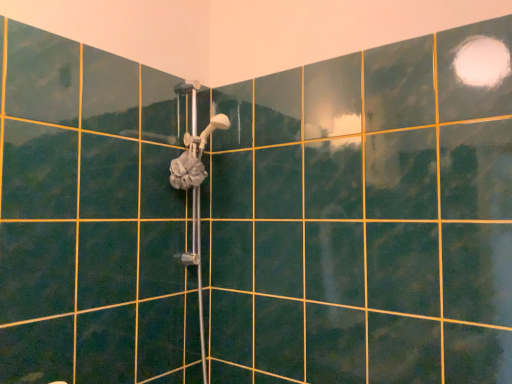
The image size is (512, 384). Find the location of `silver metallic shower head at center`. silver metallic shower head at center is located at coordinates (194, 189).

What is the approximate width of silver metallic shower head at center?

The width of silver metallic shower head at center is 10.95 inches.

This screenshot has height=384, width=512. What do you see at coordinates (194, 189) in the screenshot?
I see `silver metallic shower head at center` at bounding box center [194, 189].

This screenshot has width=512, height=384. Identify the location of silver metallic shower head at center. (194, 189).